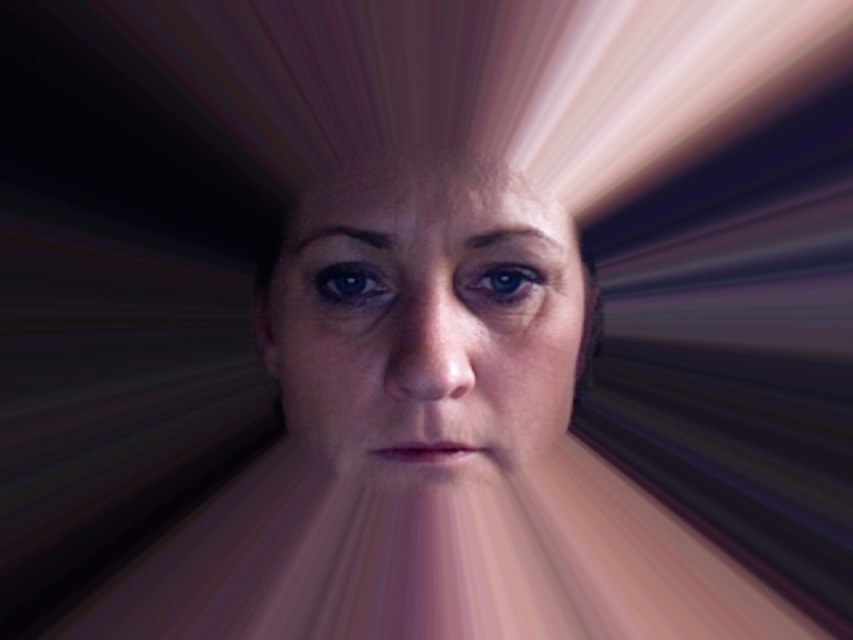
Question: Does smooth skin face at center appear under blue glossy eye at center?

Choices:
 (A) yes
 (B) no

Answer: (A)

Question: Does blue glossy eye at center appear under matte blue eye at center?

Choices:
 (A) yes
 (B) no

Answer: (B)

Question: Among these objects, which one is farthest from the camera?

Choices:
 (A) matte blue eye at center
 (B) blue glossy eye at center
 (C) smooth skin face at center

Answer: (A)

Question: Which of the following is the farthest from the observer?

Choices:
 (A) coord(381,278)
 (B) coord(483,177)
 (C) coord(482,296)

Answer: (A)

Question: Which object is farther from the camera taking this photo?

Choices:
 (A) matte blue eye at center
 (B) blue glossy eye at center
 (C) smooth skin face at center

Answer: (A)

Question: Is blue glossy eye at center to the left of matte blue eye at center from the viewer's perspective?

Choices:
 (A) yes
 (B) no

Answer: (B)